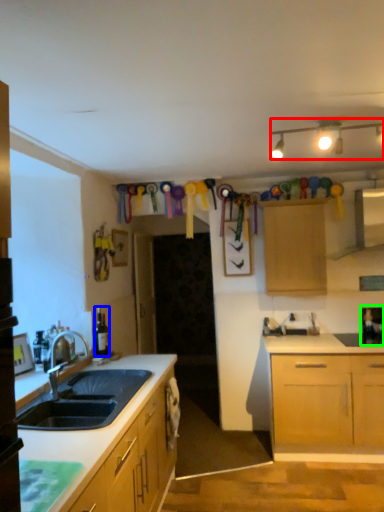
Question: Which object is positioned closest to lamp (highlighted by a red box)? Select from bottle (highlighted by a blue box) and appliance (highlighted by a green box).

Choices:
 (A) bottle
 (B) appliance

Answer: (B)